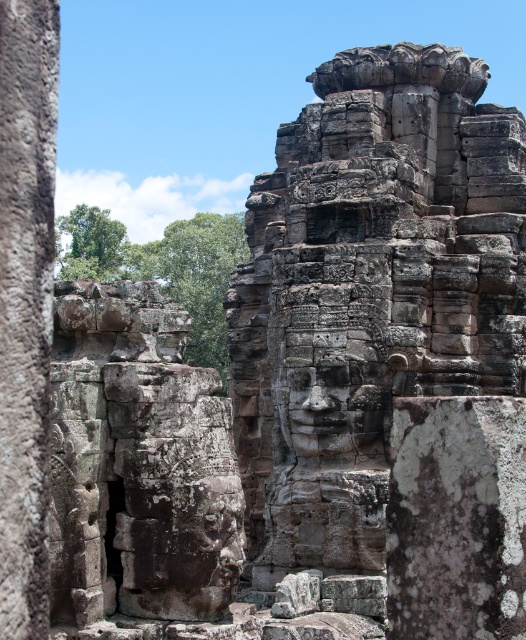
Between rough stone carving at left and rough stone face at center, which one has less height?

rough stone face at center is shorter.

Which is more to the right, rough stone carving at left or rough stone face at center?

Positioned to the right is rough stone face at center.

Consider the image. Who is more forward, (0,156) or (319,355)?

Point (0,156) is in front.

The width and height of the screenshot is (526, 640). In order to click on rough stone carving at left in this screenshot , I will do (x=25, y=307).

Based on the photo, who is positioned more to the left, weathered stone face at center or rough stone face at center?

weathered stone face at center

Can you confirm if weathered stone face at center is taller than rough stone face at center?

Yes, weathered stone face at center is taller than rough stone face at center.

Who is more distant from viewer, (298, 125) or (310, 429)?

Point (298, 125)

Find the location of a particular element. Image resolution: width=526 pixels, height=640 pixels. weathered stone face at center is located at coordinates (369, 292).

Who is taller, weathered stone face at center or rough stone carving at left?

Standing taller between the two is weathered stone face at center.

At what (x,y) coordinates should I click in order to perform the action: click on weathered stone face at center. Please return your answer as a coordinate pair (x, y). This screenshot has width=526, height=640. Looking at the image, I should click on (369, 292).

Which is in front, point (461, 314) or point (17, 440)?

Point (17, 440) is more forward.

At what (x,y) coordinates should I click in order to perform the action: click on weathered stone face at center. Please return your answer as a coordinate pair (x, y). Looking at the image, I should click on (369, 292).